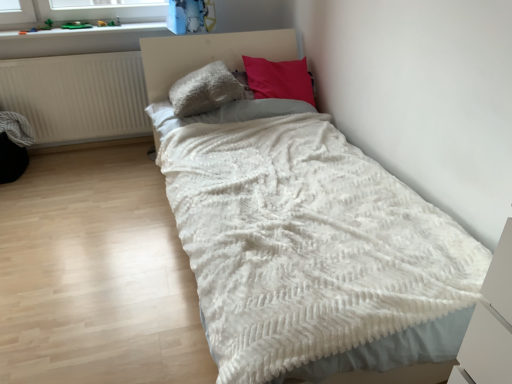
Where is `vacant region under white matte radiator at left (from a real-world perspective)`? The image size is (512, 384). vacant region under white matte radiator at left (from a real-world perspective) is located at coordinates (88, 150).